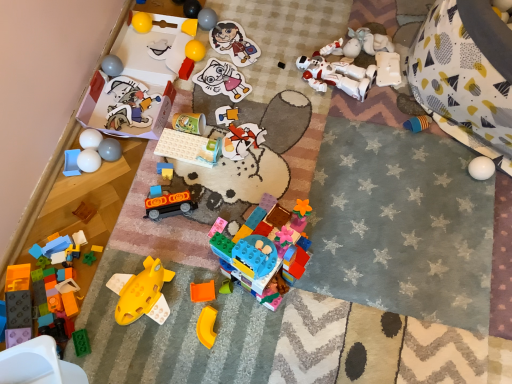
At what (x,y) coordinates should I click in order to perform the action: click on free space between yellow matte plastic piece at center, the seventeenth toy viewed from the left, and black plastic train at center, the 14th toy from the right. Please return your answer as a coordinate pair (x, y). The width and height of the screenshot is (512, 384). Looking at the image, I should click on (186, 268).